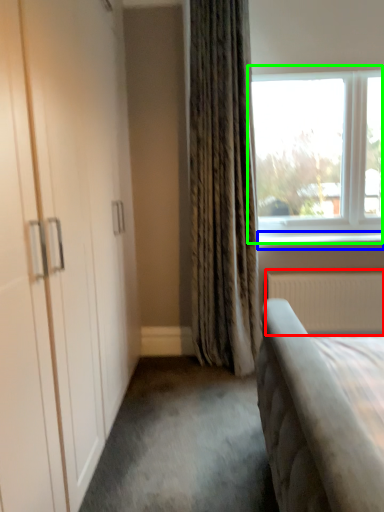
Question: Which object is the farthest from radiator (highlighted by a red box)? Choose among these: window sill (highlighted by a blue box) or window (highlighted by a green box).

Choices:
 (A) window sill
 (B) window

Answer: (B)